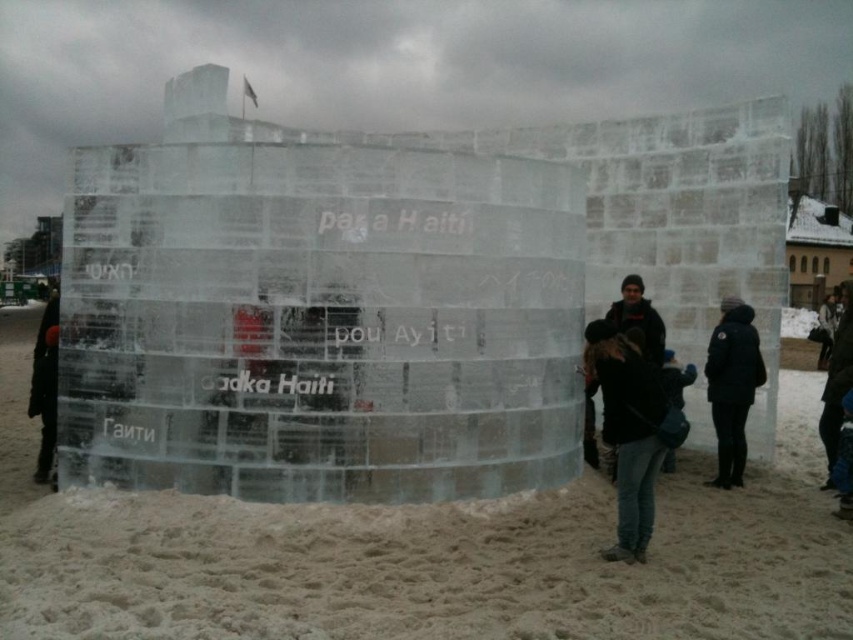
Question: Which of the following is the farthest from the observer?

Choices:
 (A) black matte jacket at right
 (B) white sand at lower center

Answer: (A)

Question: Can you confirm if white sand at lower center is smaller than dark blue jeans at lower right?

Choices:
 (A) yes
 (B) no

Answer: (B)

Question: Is dark blue jeans at lower right in front of black matte jacket at right?

Choices:
 (A) no
 (B) yes

Answer: (B)

Question: Does dark blue jeans at lower right have a lesser width compared to black matte jacket at right?

Choices:
 (A) yes
 (B) no

Answer: (B)

Question: Which point appears closest to the camera in this image?

Choices:
 (A) (722, 316)
 (B) (236, 522)

Answer: (B)

Question: Which of the following is the farthest from the observer?

Choices:
 (A) white sand at lower center
 (B) dark blue jeans at lower right
 (C) black matte jacket at right

Answer: (C)